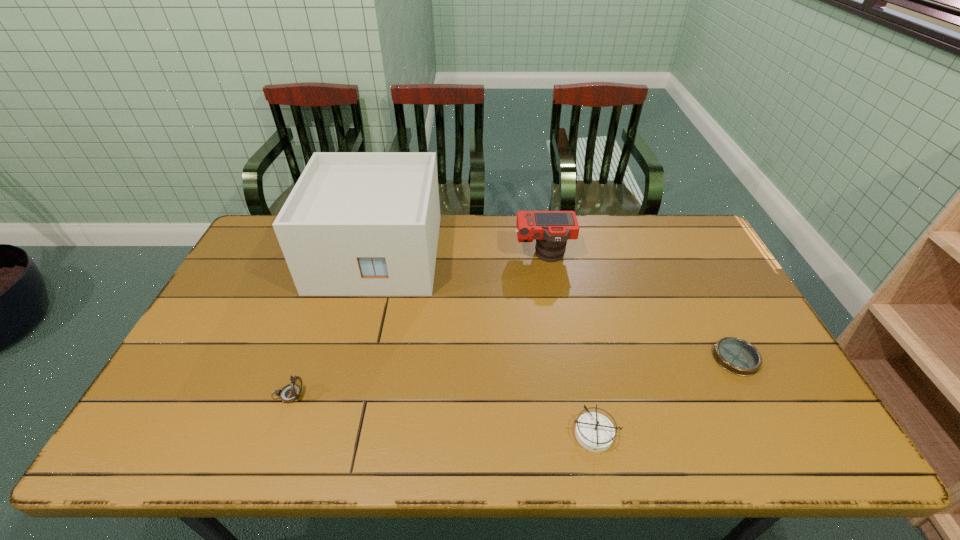
Find the location of a particular element. This screenshot has height=540, width=960. free location at the right edge is located at coordinates (708, 295).

Identify the location of free space at the far right corner of the desktop. This screenshot has width=960, height=540. (684, 250).

Where is `blank area at the near right corner`? Image resolution: width=960 pixels, height=540 pixels. blank area at the near right corner is located at coordinates (797, 445).

Locate an element on the screen. The height and width of the screenshot is (540, 960). empty space that is in between the nearest object and the rightmost compass is located at coordinates (665, 396).

Identify the location of free area in between the shortest object and the tallest object. (557, 306).

Locate an element on the screen. The image size is (960, 540). unoccupied area between the second compass from left to right and the camera is located at coordinates (569, 345).

What are the coordinates of `free spot between the tallest compass and the fourth shortest object` in the screenshot? It's located at (416, 325).

You are a GUI agent. You are given a task and a screenshot of the screen. Output one action in this format:
    pyautogui.click(x=<x>, y=<y>)
    Task: Click on the free point between the tallest compass and the camera
    The image size is (960, 540).
    Given the screenshot: What is the action you would take?
    pyautogui.click(x=416, y=325)

Locate an element on the screen. The width and height of the screenshot is (960, 540). free space between the box and the camera is located at coordinates pos(461,254).

Find the location of a particular element. Image resolution: width=960 pixels, height=540 pixels. free space between the leftmost compass and the shortest compass is located at coordinates (512, 376).